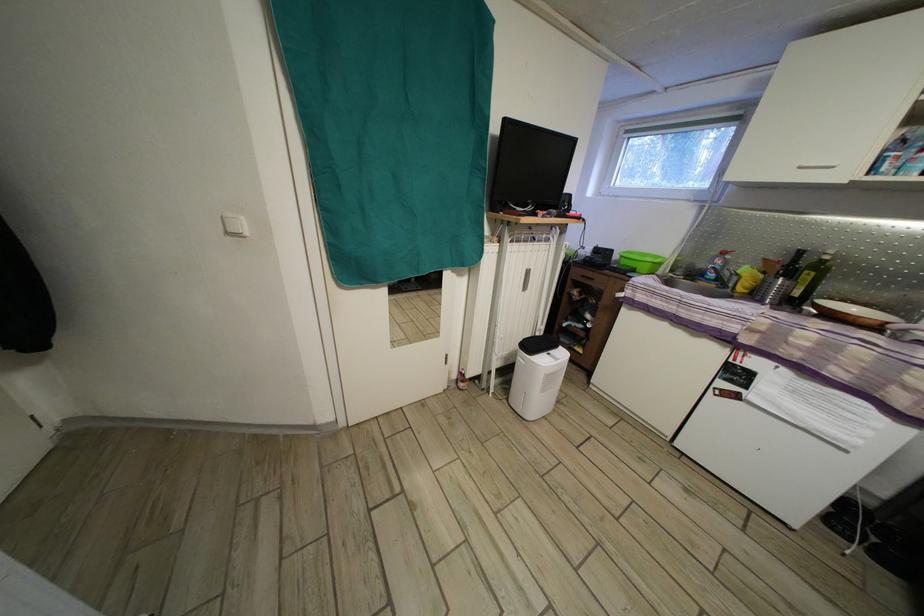
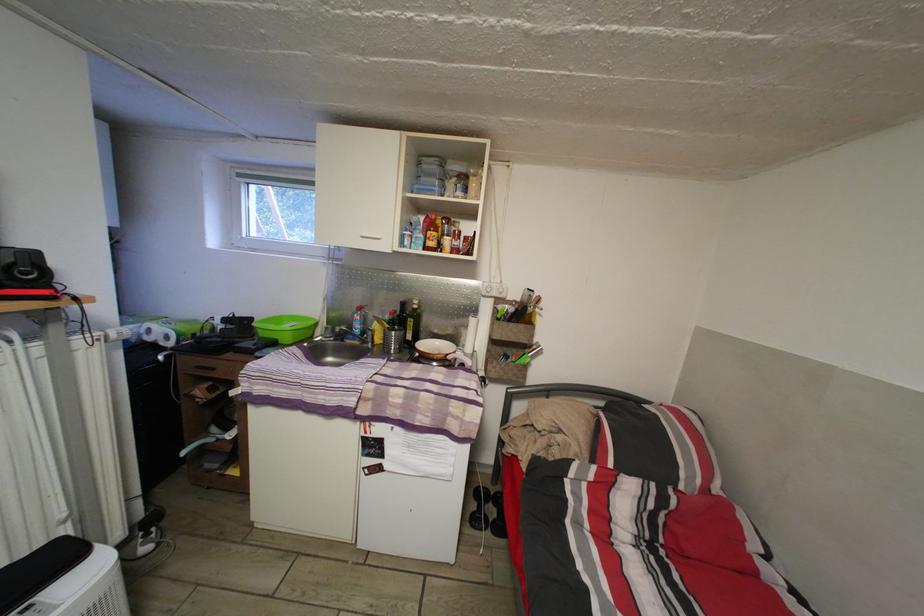
In the second image, find the point that corresponds to point (804, 300) in the first image.

(417, 344)